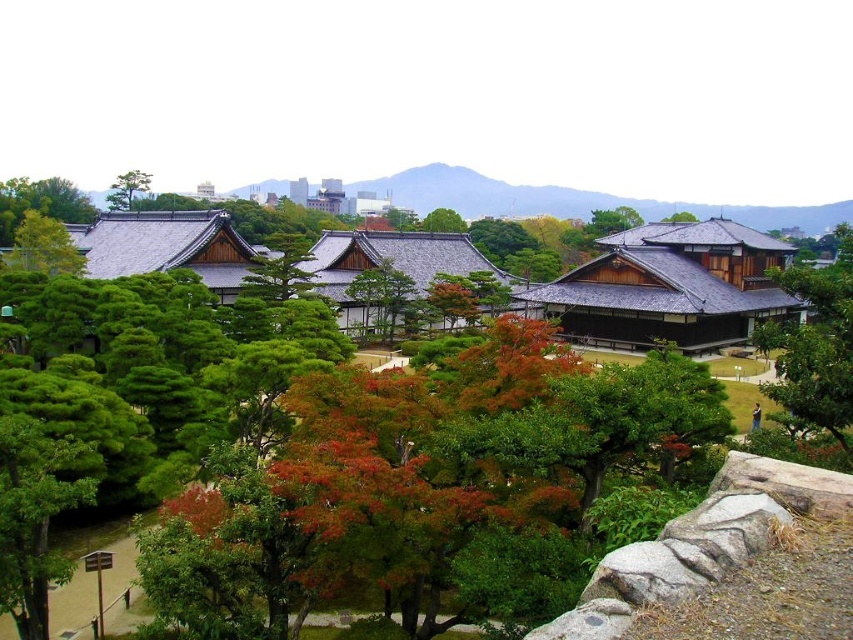
You are standing in the traditional Japanese garden and want to take a photo of the green grassy hillside at center and the green matte tree at upper center. Which one should you frame first in your camera viewfinder to capture both in the same shot?

You should frame the green grassy hillside at center first because it is to the left of the green matte tree at upper center, so positioning it first will allow both to be included in the shot.

You are standing at the entrance of the garden and notice two elements in the scene. The first is the green grassy hillside at center, and the second is the green matte tree at upper center. Which of these two elements is positioned higher up in the image?

The green grassy hillside at center is positioned above the green matte tree at upper center, so the green grassy hillside at center is higher up in the image.

You are a gardener planning to plant a new tree in the Japanese garden scene. You have two options for locations based on the existing green grassy hillside at center and the green matte tree at upper center. Which location has more space available for the new tree?

The green grassy hillside at center has a smaller size compared to the green matte tree at upper center, so the green matte tree at upper center has more space available for the new tree.